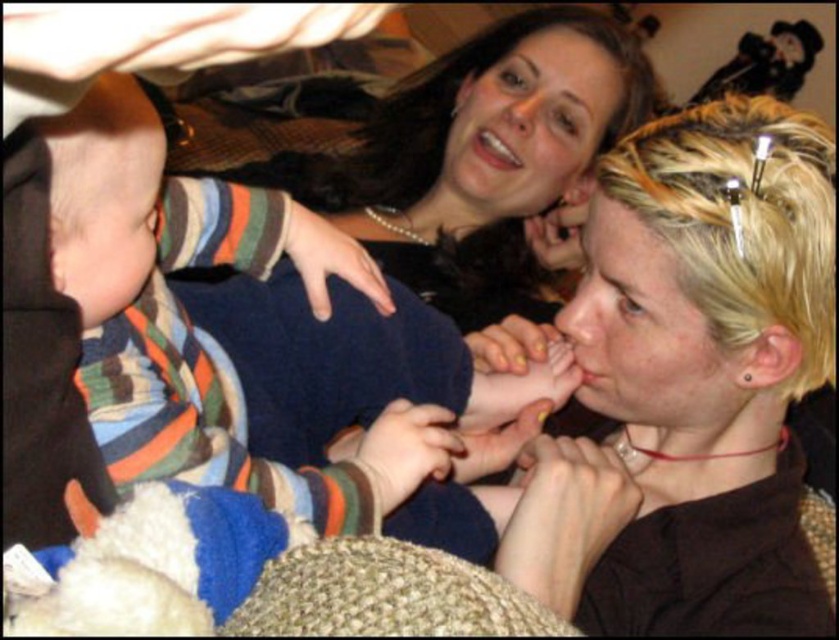
Question: In this image, where is striped cotton shirt at left located relative to matte silver ring at lower center?

Choices:
 (A) below
 (B) above

Answer: (B)

Question: Which point is farther to the camera?

Choices:
 (A) (290, 225)
 (B) (803, 307)
 (C) (550, 557)

Answer: (A)

Question: Which object is the farthest from the striped cotton shirt at left?

Choices:
 (A) matte silver ring at lower center
 (B) yellow painted nails at center

Answer: (A)

Question: Based on their relative distances, which object is nearer to the matte silver ring at lower center?

Choices:
 (A) yellow painted nails at center
 (B) smooth blonde hair at center
 (C) striped cotton shirt at left
 (D) matte blue sweater at center

Answer: (B)

Question: Does smooth blonde hair at center appear on the right side of matte blue sweater at center?

Choices:
 (A) no
 (B) yes

Answer: (B)

Question: Does matte silver ring at lower center appear over yellow painted nails at center?

Choices:
 (A) yes
 (B) no

Answer: (B)